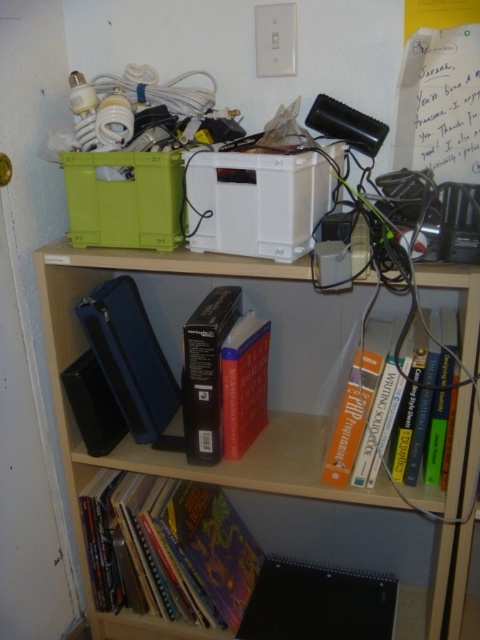
Question: Can you confirm if wooden bookshelf at center is wider than multicolored paperbacks at lower left?

Choices:
 (A) no
 (B) yes

Answer: (B)

Question: Which object is closer to the camera taking this photo?

Choices:
 (A) multicolored paperbacks at lower left
 (B) wooden bookshelf at center
 (C) red matte book at center

Answer: (B)

Question: Among these points, which one is farthest from the camera?

Choices:
 (A) (225, 435)
 (B) (220, 522)
 (C) (352, 449)

Answer: (B)

Question: Does wooden bookshelf at center have a larger size compared to multicolored paperbacks at lower left?

Choices:
 (A) no
 (B) yes

Answer: (B)

Question: Which point is farther from the camera taking this photo?

Choices:
 (A) (64, 256)
 (B) (267, 324)
 (C) (241, 563)
 (D) (393, 326)

Answer: (C)

Question: Does wooden bookshelf at center appear on the right side of multicolored paperbacks at lower left?

Choices:
 (A) yes
 (B) no

Answer: (A)